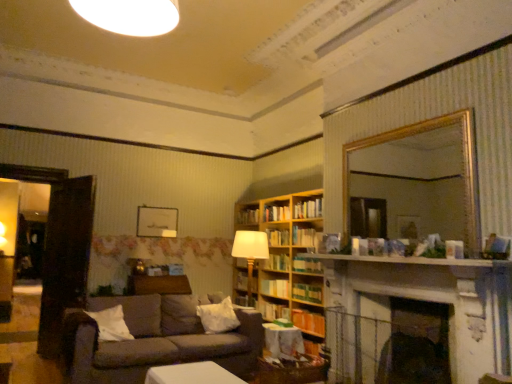
Question: From a real-world perspective, does hardcover book at center, the eighth book positioned from the bottom, sit lower than white soft pillow at center, which appears as the 2th pillow when viewed from the left?

Choices:
 (A) yes
 (B) no

Answer: (B)

Question: Is hardcover book at center, arranged as the fourth book when viewed from the top, turned away from white soft pillow at center, positioned as the first pillow in back-to-front order?

Choices:
 (A) no
 (B) yes

Answer: (A)

Question: Is hardcover book at center, the eighth book positioned from the bottom, bigger than white soft pillow at center, positioned as the 2th pillow in front-to-back order?

Choices:
 (A) no
 (B) yes

Answer: (A)

Question: Is hardcover book at center, arranged as the fourth book when viewed from the top, positioned beyond the bounds of white soft pillow at center, the 1th pillow in the right-to-left sequence?

Choices:
 (A) yes
 (B) no

Answer: (A)

Question: Is hardcover book at center, the eighth book positioned from the bottom, to the left of white soft pillow at center, positioned as the 2th pillow in front-to-back order, from the viewer's perspective?

Choices:
 (A) yes
 (B) no

Answer: (B)

Question: Considering the relative sizes of hardcover book at center, the eighth book positioned from the bottom, and white soft pillow at center, the 1th pillow in the right-to-left sequence, in the image provided, is hardcover book at center, the eighth book positioned from the bottom, smaller than white soft pillow at center, the 1th pillow in the right-to-left sequence,?

Choices:
 (A) no
 (B) yes

Answer: (B)

Question: Is black matte fireplace at lower center smaller than hardcover book at center, which is the first book from bottom to top?

Choices:
 (A) no
 (B) yes

Answer: (A)

Question: Considering the relative positions of black matte fireplace at lower center and hardcover book at center, which is the first book from bottom to top, in the image provided, is black matte fireplace at lower center to the right of hardcover book at center, which is the first book from bottom to top, from the viewer's perspective?

Choices:
 (A) no
 (B) yes

Answer: (B)

Question: Can you confirm if black matte fireplace at lower center is taller than hardcover book at center, which is the first book from bottom to top?

Choices:
 (A) yes
 (B) no

Answer: (A)

Question: Does black matte fireplace at lower center have a greater width compared to hardcover book at center, which is the first book from bottom to top?

Choices:
 (A) no
 (B) yes

Answer: (B)

Question: Considering the relative positions of black matte fireplace at lower center and hardcover book at center, the 11th book in the top-to-bottom sequence, in the image provided, is black matte fireplace at lower center behind hardcover book at center, the 11th book in the top-to-bottom sequence,?

Choices:
 (A) yes
 (B) no

Answer: (B)

Question: From the image's perspective, is black matte fireplace at lower center on hardcover book at center, the 11th book in the top-to-bottom sequence?

Choices:
 (A) yes
 (B) no

Answer: (A)

Question: Could you tell me if hardcover book at center, which ranks as the 7th book in top-to-bottom order, is facing hardcover book at center, which is the 8th book from top to bottom?

Choices:
 (A) yes
 (B) no

Answer: (B)